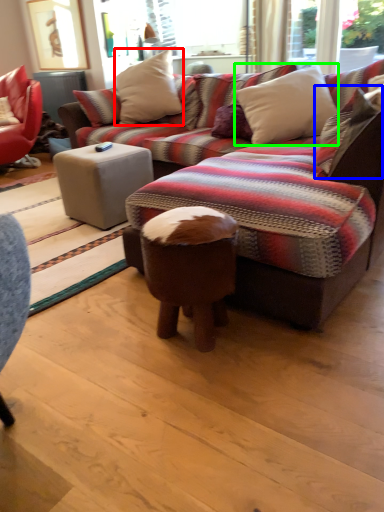
Question: Estimate the real-world distances between objects in this image. Which object is farther from pillow (highlighted by a red box), pillow (highlighted by a blue box) or pillow (highlighted by a green box)?

Choices:
 (A) pillow
 (B) pillow

Answer: (A)